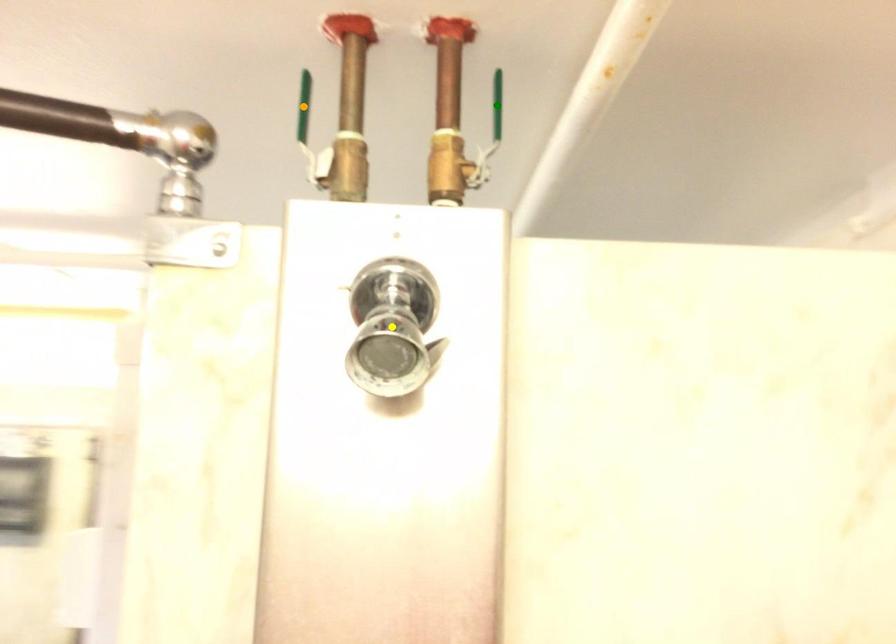
Order these from nearest to farthest:
orange point, green point, yellow point

green point, orange point, yellow point